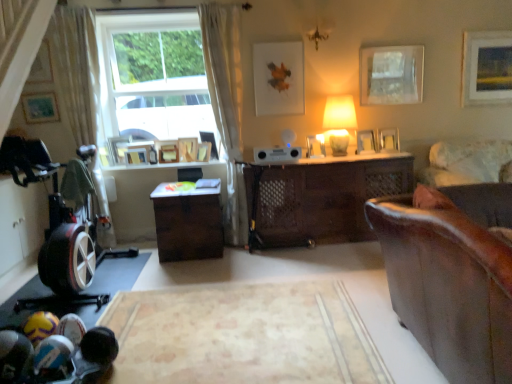
Where is `free location in front of wooden picture frame at upper center, which is the tenth picture frame from right to left`? Image resolution: width=512 pixels, height=384 pixels. free location in front of wooden picture frame at upper center, which is the tenth picture frame from right to left is located at coordinates (164, 167).